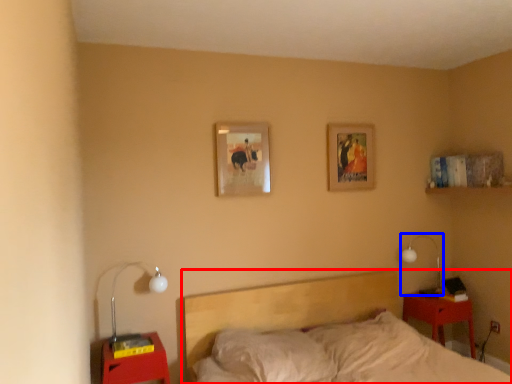
Question: Which object is further to the camera taking this photo, bed (highlighted by a red box) or lamp (highlighted by a blue box)?

Choices:
 (A) bed
 (B) lamp

Answer: (B)